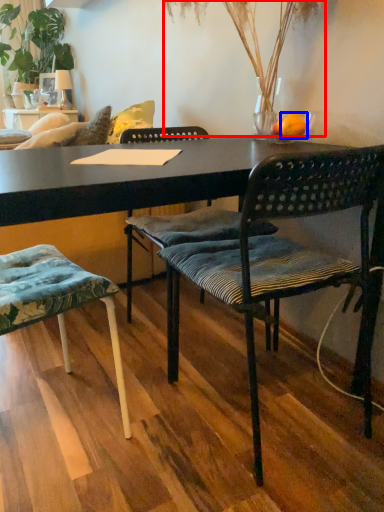
Question: Which of the following is the farthest to the observer, plant (highlighted by a red box) or orange (highlighted by a blue box)?

Choices:
 (A) plant
 (B) orange

Answer: (B)